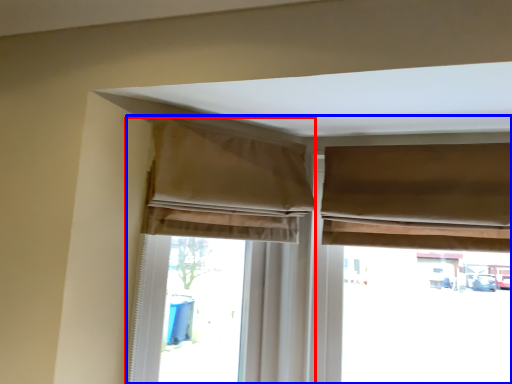
Question: Among these objects, which one is farthest to the camera, curtain (highlighted by a red box) or window (highlighted by a blue box)?

Choices:
 (A) curtain
 (B) window

Answer: (B)